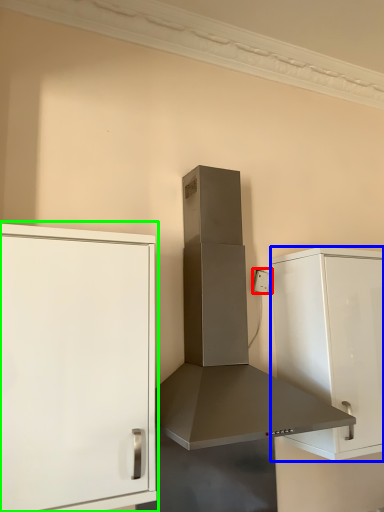
Question: Considering the real-world distances, which object is farthest from electric outlet (highlighted by a red box)? cabinetry (highlighted by a blue box) or cabinetry (highlighted by a green box)?

Choices:
 (A) cabinetry
 (B) cabinetry

Answer: (B)